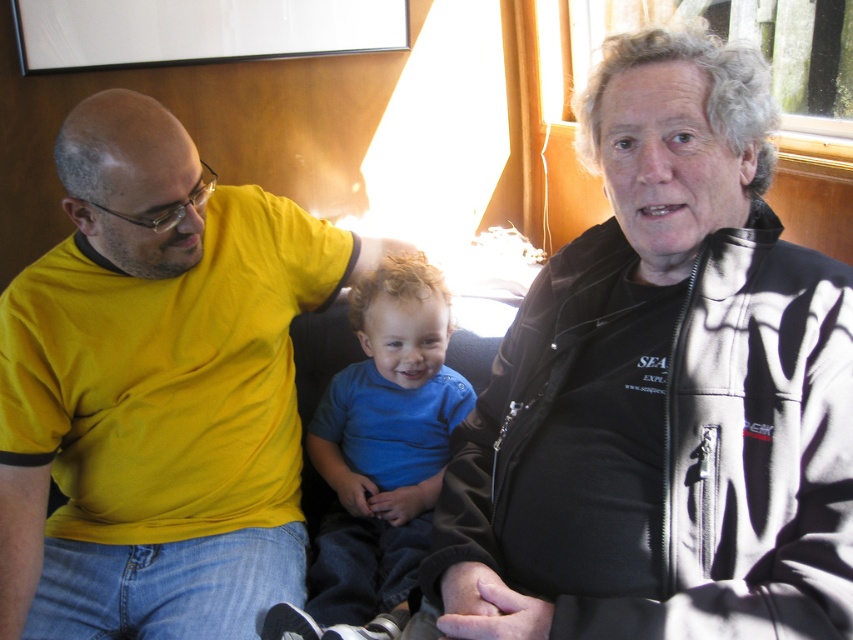
Is black softshell jacket at upper right positioned at the back of yellow t-shirt at left?

No, black softshell jacket at upper right is in front of yellow t-shirt at left.

Does point (550, 358) come closer to viewer compared to point (172, 506)?

Yes, it is in front of point (172, 506).

Which is behind, point (746, 216) or point (299, 285)?

The point (299, 285) is more distant.

Where is `black softshell jacket at upper right`? black softshell jacket at upper right is located at coordinates (662, 390).

Consider the image. Which is below, black softshell jacket at upper right or blue smooth shirt at center?

blue smooth shirt at center is lower down.

Who is taller, black softshell jacket at upper right or blue smooth shirt at center?

black softshell jacket at upper right is taller.

The image size is (853, 640). What are the coordinates of `black softshell jacket at upper right` in the screenshot? It's located at (662, 390).

Is yellow t-shirt at left to the right of blue smooth shirt at center from the viewer's perspective?

In fact, yellow t-shirt at left is to the left of blue smooth shirt at center.

Does yellow t-shirt at left have a greater width compared to blue smooth shirt at center?

Correct, the width of yellow t-shirt at left exceeds that of blue smooth shirt at center.

I want to click on yellow t-shirt at left, so click(x=157, y=390).